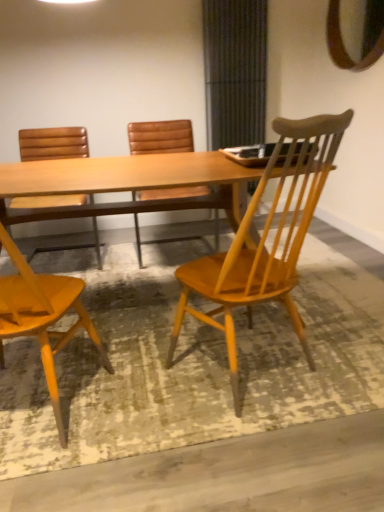
This screenshot has width=384, height=512. I want to click on vacant area that lies to the right of matte wood chair at left, the third chair viewed from the right, so click(x=143, y=411).